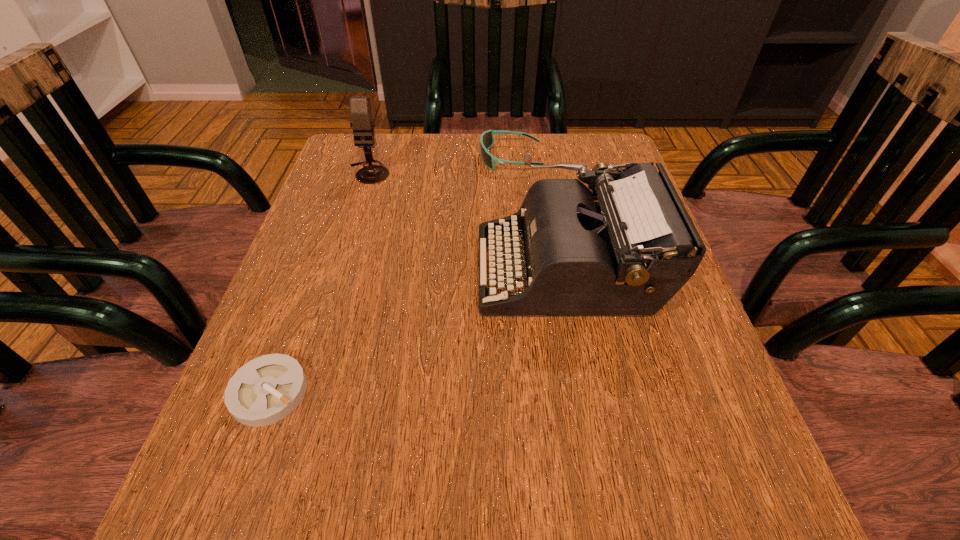
The width and height of the screenshot is (960, 540). Identify the location of microphone. (360, 108).

Locate an element on the screen. typewriter is located at coordinates click(x=626, y=248).

Identify the location of sunglasses. The image size is (960, 540). click(487, 138).

Find the location of a particular element. the shortest object is located at coordinates (265, 390).

You are a GUI agent. You are given a task and a screenshot of the screen. Output one action in this format:
    pyautogui.click(x=<x>, y=<y>)
    Task: Click on the ashtray
    Image resolution: width=960 pixels, height=540 pixels.
    Given the screenshot: What is the action you would take?
    pyautogui.click(x=265, y=390)

Locate an element on the screen. The image size is (960, 540). free region located 0.080m on the front-facing side of the microphone is located at coordinates (359, 205).

You are a GUI agent. You are given a task and a screenshot of the screen. Output one action in this format:
    pyautogui.click(x=<x>, y=<y>)
    Task: Click on the vacant space located 0.350m on the front-facing side of the third farthest object
    
    Given the screenshot: What is the action you would take?
    pyautogui.click(x=295, y=269)

What are the coordinates of `free space located 0.330m on the front-facing side of the third farthest object` in the screenshot? It's located at (305, 269).

The height and width of the screenshot is (540, 960). What are the coordinates of `free location located on the front-facing side of the third farthest object` in the screenshot? It's located at (305, 269).

Identify the location of free space located 0.220m on the front-facing side of the sunglasses. (393, 158).